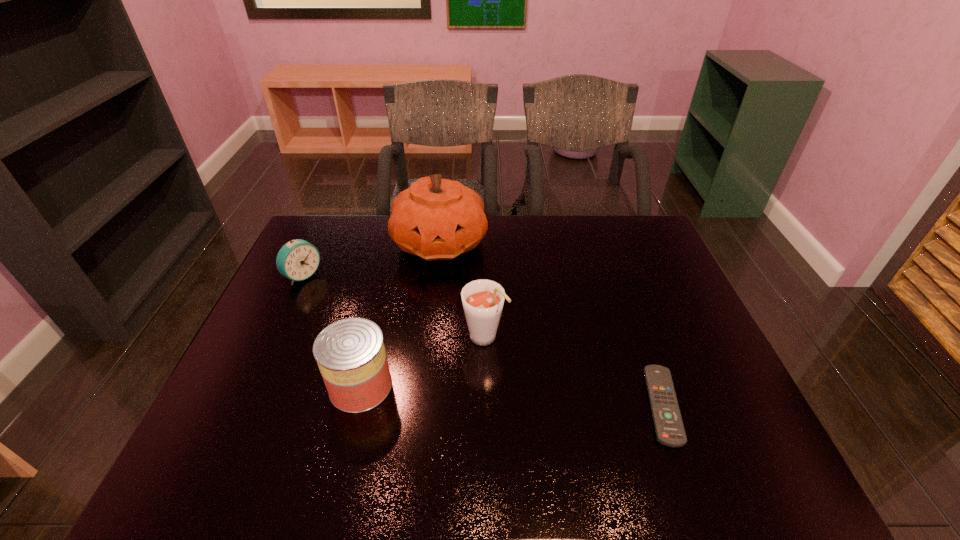
The width and height of the screenshot is (960, 540). In the image, there is a desktop. In order to click on free space at the far right corner in this screenshot , I will do `click(638, 247)`.

Locate an element on the screen. Image resolution: width=960 pixels, height=540 pixels. vacant region between the second tallest object and the rightmost object is located at coordinates (574, 372).

Where is `free spot between the can and the rightmost object`? free spot between the can and the rightmost object is located at coordinates (512, 395).

Find the location of a particular element. This screenshot has width=960, height=540. free space between the pumpkin and the leftmost object is located at coordinates 372,259.

Where is `empty location between the rightmost object and the third tallest object`? empty location between the rightmost object and the third tallest object is located at coordinates (512, 395).

Identify the location of free point between the pumpkin and the remote control. This screenshot has width=960, height=540. (552, 323).

Locate which object ranks third in proximity to the tallest object. Please provide its 2D coordinates. Your answer should be formatted as a tuple, i.e. [(x, y)], where the tuple contains the x and y coordinates of a point satisfying the conditions above.

[(350, 353)]

I want to click on object identified as the third closest to the pumpkin, so click(x=350, y=353).

The width and height of the screenshot is (960, 540). I want to click on vacant space that satisfies the following two spatial constraints: 1. on the front side of the rightmost object; 2. on the right side of the third shortest object, so click(356, 405).

What are the coordinates of `vacant position in the image that satisfies the following two spatial constraints: 1. on the front side of the tallest object; 2. on the left side of the shortest object` in the screenshot? It's located at (421, 405).